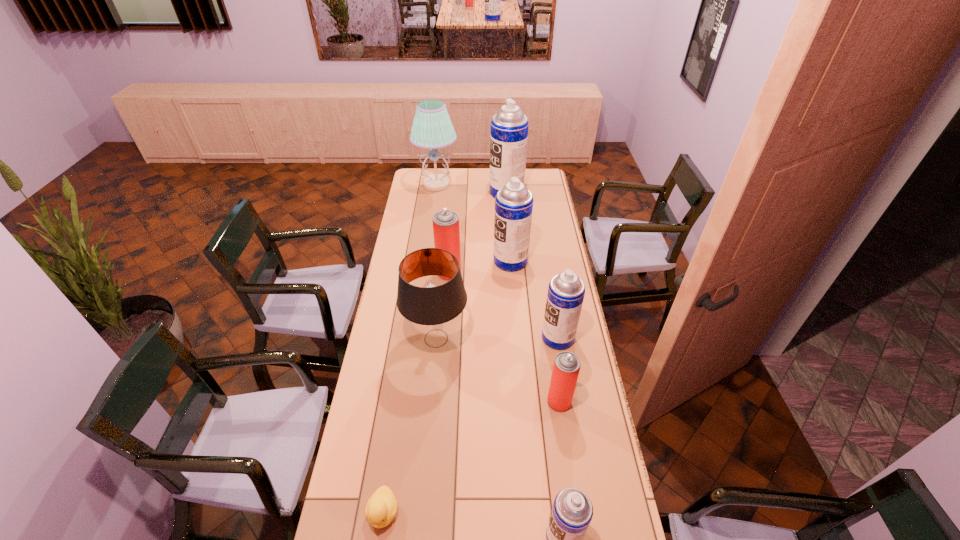
The height and width of the screenshot is (540, 960). What are the coordinates of `the nearer red aerosol can` in the screenshot? It's located at (566, 367).

Find the location of a particular element. the smaller red aerosol can is located at coordinates (566, 367).

You are a GUI agent. You are given a task and a screenshot of the screen. Output one action in this format:
    pyautogui.click(x=<x>, y=<y>)
    Task: Click on the shortest object
    
    Given the screenshot: What is the action you would take?
    pyautogui.click(x=381, y=508)

Where is `free space located on the label side of the farthest aerosol can`? This screenshot has height=540, width=960. free space located on the label side of the farthest aerosol can is located at coordinates (477, 192).

Where is `vacant point located 0.170m on the label side of the farthest aerosol can`? vacant point located 0.170m on the label side of the farthest aerosol can is located at coordinates (460, 192).

Identify the location of vacant space located on the label side of the farthest aerosol can. The height and width of the screenshot is (540, 960). (470, 192).

Find the location of `free space located 0.330m on the right of the teal lamp`. free space located 0.330m on the right of the teal lamp is located at coordinates (514, 184).

Find the location of a particular element. This screenshot has width=960, height=540. free space located on the label side of the second farthest blue aerosol can is located at coordinates (445, 261).

This screenshot has height=540, width=960. Identify the location of vacant region located on the label side of the second farthest blue aerosol can. (468, 261).

At what (x,y) coordinates should I click in order to perform the action: click on vacant position located on the label side of the second farthest blue aerosol can. Please return your answer as a coordinate pair (x, y). The image size is (960, 540). Looking at the image, I should click on (458, 261).